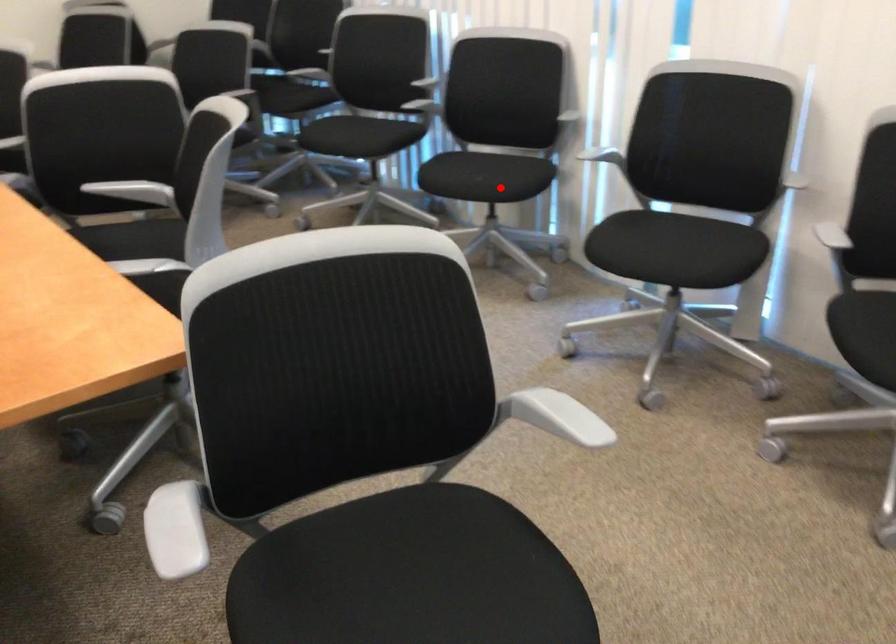
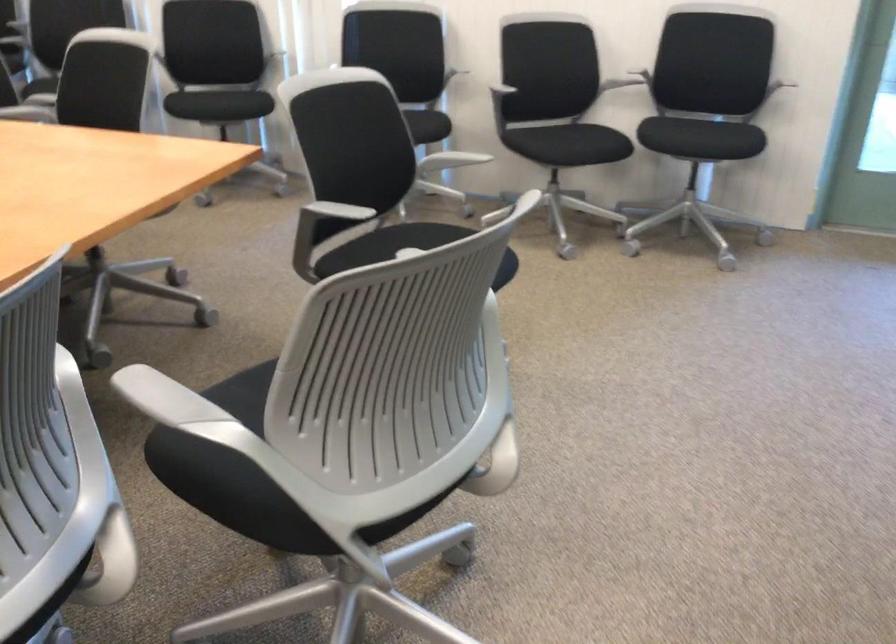
In the second image, find the point that corresponds to the highlighted location in the first image.

(238, 102)